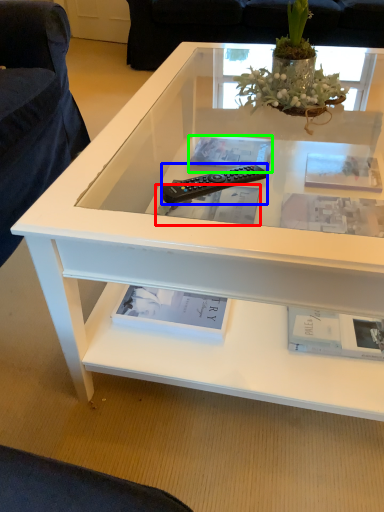
Question: Considering the real-world distances, which object is closest to book (highlighted by a red box)? remote control (highlighted by a blue box) or book (highlighted by a green box).

Choices:
 (A) remote control
 (B) book

Answer: (B)